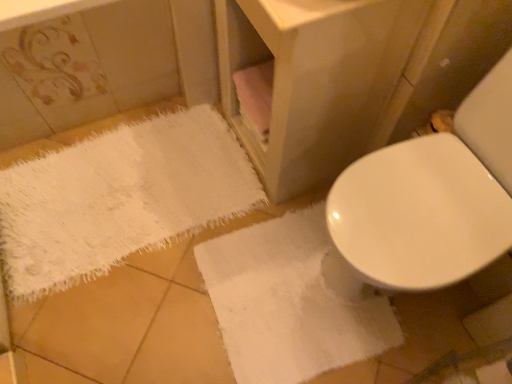
Question: Is the depth of white fluffy bath towel at lower right, which is the second bath towel in left-to-right order, greater than that of matte wood vanity at center?

Choices:
 (A) yes
 (B) no

Answer: (A)

Question: From the image's perspective, is white fluffy bath towel at lower right, the first bath towel positioned from the right, on top of matte wood vanity at center?

Choices:
 (A) no
 (B) yes

Answer: (A)

Question: Can you confirm if white fluffy bath towel at lower right, which is the second bath towel in left-to-right order, is smaller than matte wood vanity at center?

Choices:
 (A) yes
 (B) no

Answer: (A)

Question: From the image's perspective, would you say white fluffy bath towel at lower right, the first bath towel positioned from the right, is shown under matte wood vanity at center?

Choices:
 (A) no
 (B) yes

Answer: (B)

Question: From a real-world perspective, is white fluffy bath towel at lower left, the 2th bath towel when ordered from right to left, physically located above or below white fluffy bath towel at lower right, the first bath towel positioned from the right?

Choices:
 (A) below
 (B) above

Answer: (A)

Question: Considering the positions of white fluffy bath towel at lower left, the 2th bath towel when ordered from right to left, and white fluffy bath towel at lower right, which is the second bath towel in left-to-right order, in the image, is white fluffy bath towel at lower left, the 2th bath towel when ordered from right to left, taller or shorter than white fluffy bath towel at lower right, which is the second bath towel in left-to-right order,?

Choices:
 (A) tall
 (B) short

Answer: (A)

Question: Considering their positions, is white fluffy bath towel at lower left, the first bath towel positioned from the left, located in front of or behind white fluffy bath towel at lower right, which is the second bath towel in left-to-right order?

Choices:
 (A) behind
 (B) front

Answer: (A)

Question: Based on their sizes in the image, would you say white fluffy bath towel at lower left, the first bath towel positioned from the left, is bigger or smaller than white fluffy bath towel at lower right, which is the second bath towel in left-to-right order?

Choices:
 (A) small
 (B) big

Answer: (B)

Question: From the image's perspective, relative to white fluffy bath towel at lower left, the first bath towel positioned from the left, is white fluffy bath towel at lower right, the first bath towel positioned from the right, above or below?

Choices:
 (A) below
 (B) above

Answer: (A)

Question: From a real-world perspective, is white fluffy bath towel at lower right, which is the second bath towel in left-to-right order, above or below white fluffy bath towel at lower left, the 2th bath towel when ordered from right to left?

Choices:
 (A) above
 (B) below

Answer: (A)

Question: Is point (247, 258) closer or farther from the camera than point (200, 170)?

Choices:
 (A) farther
 (B) closer

Answer: (B)

Question: Which is correct: white fluffy bath towel at lower right, which is the second bath towel in left-to-right order, is inside white fluffy bath towel at lower left, the 2th bath towel when ordered from right to left, or outside of it?

Choices:
 (A) outside
 (B) inside

Answer: (A)

Question: Is white fluffy bath towel at lower right, the first bath towel positioned from the right, in front of or behind matte wood vanity at center in the image?

Choices:
 (A) behind
 (B) front

Answer: (A)

Question: In terms of height, does white fluffy bath towel at lower right, which is the second bath towel in left-to-right order, look taller or shorter compared to matte wood vanity at center?

Choices:
 (A) tall
 (B) short

Answer: (B)